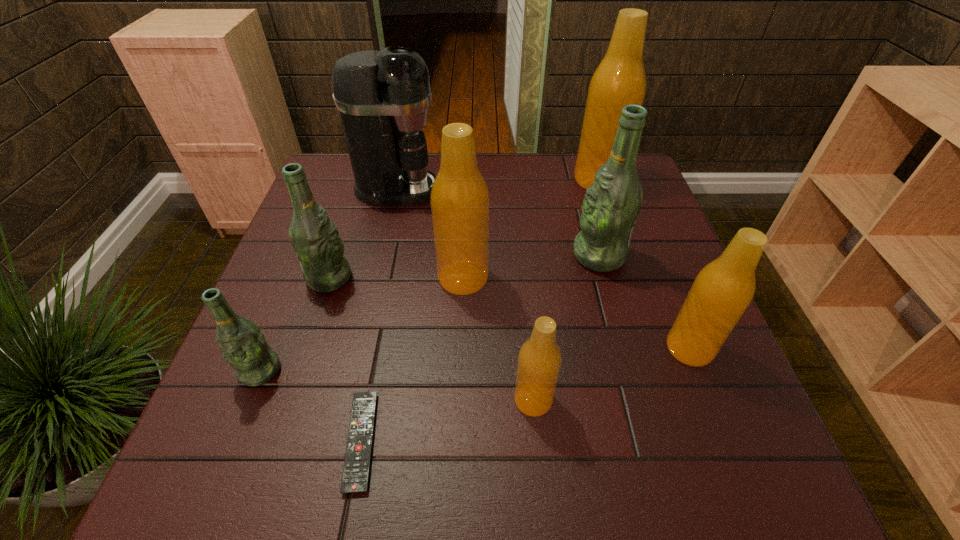
In order to click on vacant area that lies between the second biggest green beer bottle and the coffee maker in this screenshot , I will do `click(364, 233)`.

Locate an element on the screen. This screenshot has width=960, height=540. vacant area between the biggest green beer bottle and the coffee maker is located at coordinates (498, 222).

Identify which object is located as the nearest to the third tan beer bottle from right to left. Please provide its 2D coordinates. Your answer should be formatted as a tuple, i.e. [(x, y)], where the tuple contains the x and y coordinates of a point satisfying the conditions above.

[(459, 199)]

You are a GUI agent. You are given a task and a screenshot of the screen. Output one action in this format:
    pyautogui.click(x=<x>, y=<y>)
    Task: Click on the second closest object to the nearest tan beer bottle
    
    Given the screenshot: What is the action you would take?
    pyautogui.click(x=355, y=476)

This screenshot has width=960, height=540. What are the coordinates of `beer bottle that is the fourth closest to the coffee maker` in the screenshot? It's located at (619, 80).

Where is `beer bottle that stands as the fifth closest to the second smallest tan beer bottle`? Image resolution: width=960 pixels, height=540 pixels. beer bottle that stands as the fifth closest to the second smallest tan beer bottle is located at coordinates (315, 239).

Select which tan beer bottle is the closest to the smallest tan beer bottle. Please provide its 2D coordinates. Your answer should be formatted as a tuple, i.e. [(x, y)], where the tuple contains the x and y coordinates of a point satisfying the conditions above.

[(459, 199)]

Identify the location of tan beer bottle that stands as the third closest to the third biggest tan beer bottle. The image size is (960, 540). (619, 80).

Identify which green beer bottle is the second closest to the shortest object. Please provide its 2D coordinates. Your answer should be formatted as a tuple, i.e. [(x, y)], where the tuple contains the x and y coordinates of a point satisfying the conditions above.

[(315, 239)]

Where is `green beer bottle that is the second closest one to the second biggest green beer bottle`? The image size is (960, 540). green beer bottle that is the second closest one to the second biggest green beer bottle is located at coordinates (612, 203).